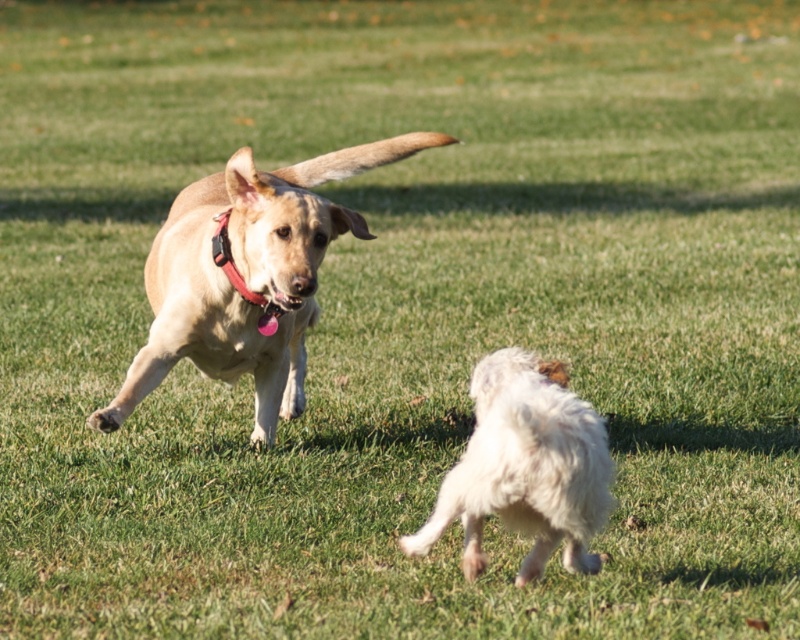
Identify the location of light brown fur dog at center. This screenshot has width=800, height=640. (248, 276).

Does light brown fur dog at center have a smaller size compared to red leather collar at upper center?

Actually, light brown fur dog at center might be larger than red leather collar at upper center.

Does point (298, 300) come farther from viewer compared to point (240, 285)?

No, (298, 300) is in front of (240, 285).

Find the location of a particular element. light brown fur dog at center is located at coordinates (248, 276).

Between light brown fur dog at center and white fluffy dog at lower right, which one has less height?

With less height is white fluffy dog at lower right.

Does point (293, 401) come behind point (480, 388)?

Yes.

Locate an element on the screen. The height and width of the screenshot is (640, 800). light brown fur dog at center is located at coordinates (248, 276).

Who is positioned more to the right, white fluffy dog at lower right or red leather collar at upper center?

white fluffy dog at lower right is more to the right.

Is point (478, 470) in front of point (236, 280)?

That is True.

Where is `white fluffy dog at lower right`? white fluffy dog at lower right is located at coordinates (525, 467).